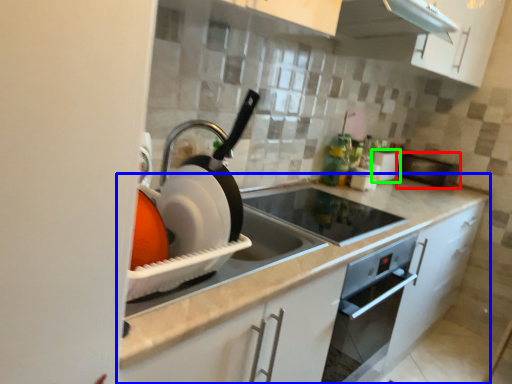
Question: Which object is positioned closest to appliance (highlighted by a red box)? Select from countertop (highlighted by a blue box) and appliance (highlighted by a green box).

Choices:
 (A) countertop
 (B) appliance

Answer: (B)